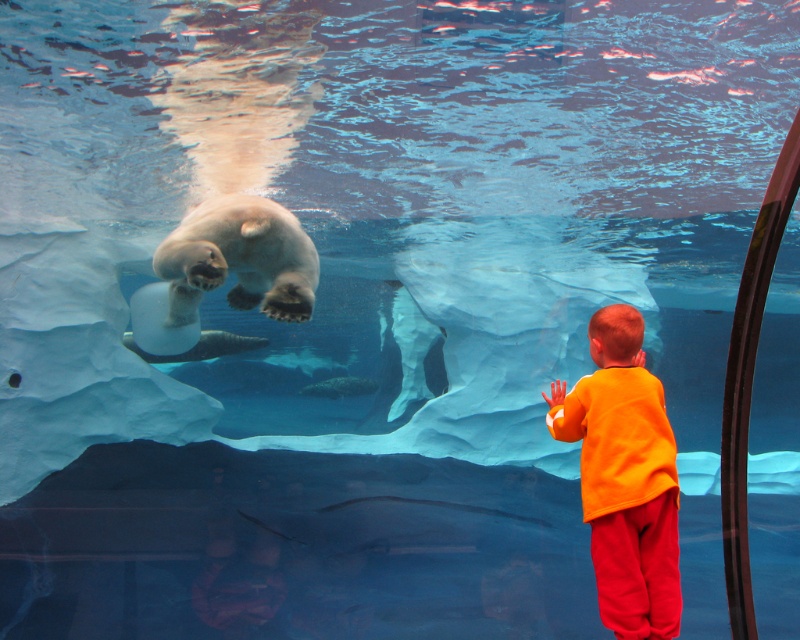
You are a zookeeper planning to place a safety barrier between the orange cotton shirt at lower right and the white matte polar bear at upper center. Based on their positions, which object is closer to the bottom of the enclosure?

The orange cotton shirt at lower right is closer to the bottom of the enclosure because it is positioned below the white matte polar bear at upper center.

You are a zookeeper standing at the entrance of the polar bear exhibit. You notice two points marked on your map at coordinates point (554,420) and point (178,257). Which point is closer to the glass where the child is standing?

Point (554,420) is in front of point (178,257), so it is closer to the glass where the child is standing.

You are a zookeeper planning to place a new feeding station between the orange cotton shirt at lower right and the white matte polar bear at upper center. Which object should the feeding station be closer to if it needs to be near the thinner one?

The orange cotton shirt at lower right is thinner than the white matte polar bear at upper center, so the feeding station should be placed closer to the orange cotton shirt at lower right.